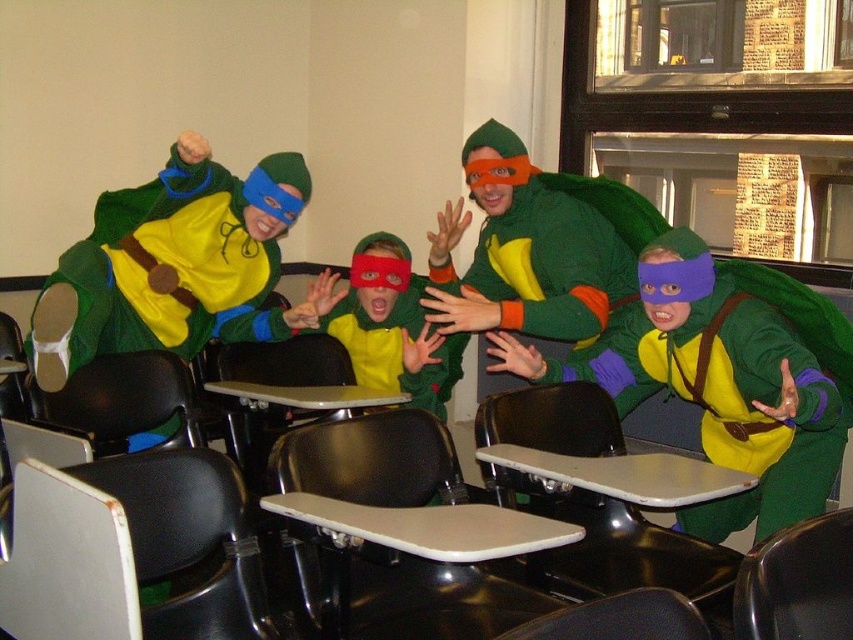
Question: Estimate the real-world distances between objects in this image. Which object is farther from the matte plastic table at center?

Choices:
 (A) matte green costume at left
 (B) matte green costume at center

Answer: (A)

Question: Which of these objects is positioned closest to the white plastic table at center?

Choices:
 (A) matte plastic table at center
 (B) matte green costume at center

Answer: (B)

Question: Does matte green costume at left have a larger size compared to matte plastic table at center?

Choices:
 (A) no
 (B) yes

Answer: (B)

Question: Does matte green costume at left have a larger size compared to matte green costume at center?

Choices:
 (A) yes
 (B) no

Answer: (A)

Question: Which object is farther from the camera taking this photo?

Choices:
 (A) matte green turtle costume at center
 (B) white plastic table at center

Answer: (B)

Question: Does matte green turtle costume at center lie behind smooth beige table at center?

Choices:
 (A) no
 (B) yes

Answer: (B)